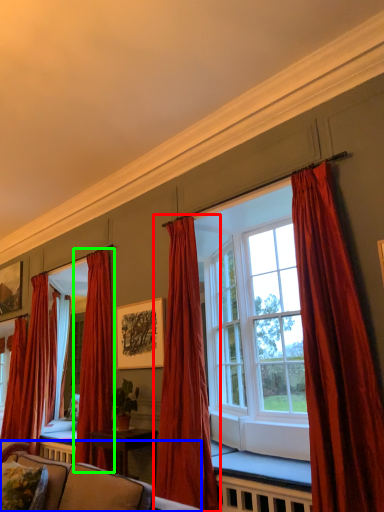
Question: Which is nearer to the curtain (highlighted by a red box)? studio couch (highlighted by a blue box) or curtain (highlighted by a green box).

Choices:
 (A) studio couch
 (B) curtain

Answer: (B)